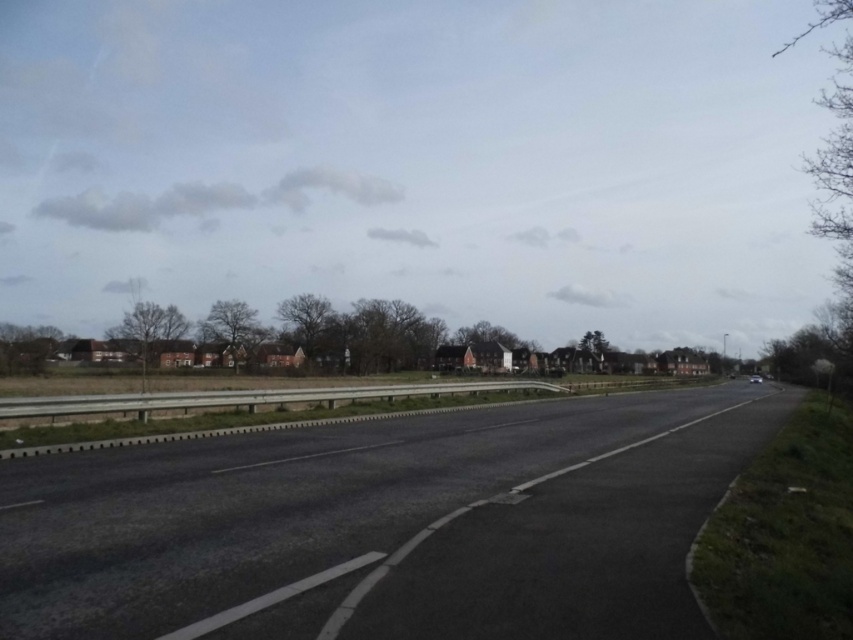
You are a surveyor measuring the length of the asphalt road at center and the smooth concrete barrier at center in the image. Which one has a greater length?

The smooth concrete barrier at center has a greater length than the asphalt road at center.

You are driving a car and want to know if you can safely pass between the asphalt road at center and the smooth concrete barrier at center. Based on their positions, can you determine if there is enough space for your car?

The asphalt road at center is in front of the smooth concrete barrier at center, meaning they are aligned along the same path. Since the road and barrier are positioned one in front of the other, there is no lateral space between them for a car to pass through safely.

You are a delivery driver approaching the asphalt road at center and the smooth concrete barrier at center. Which one is located to the right side of the other?

The asphalt road at center is positioned on the right side of the smooth concrete barrier at center.